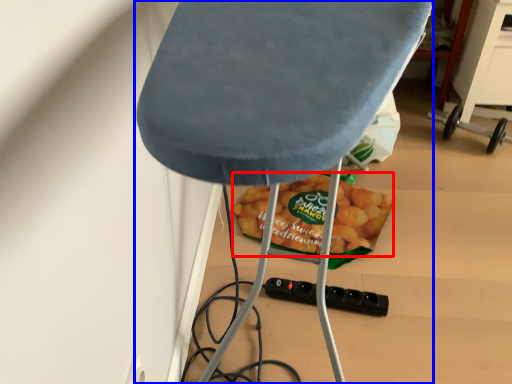
Question: Which of the following is the closest to the observer, snack (highlighted by a red box) or furniture (highlighted by a blue box)?

Choices:
 (A) snack
 (B) furniture

Answer: (B)